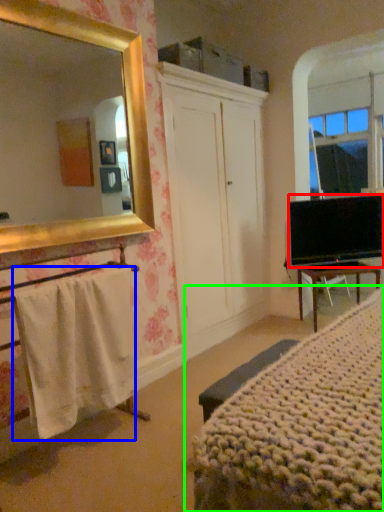
Question: Which is nearer to the television (highlighted by a red box)? towel/napkin (highlighted by a blue box) or bed (highlighted by a green box).

Choices:
 (A) towel/napkin
 (B) bed

Answer: (B)